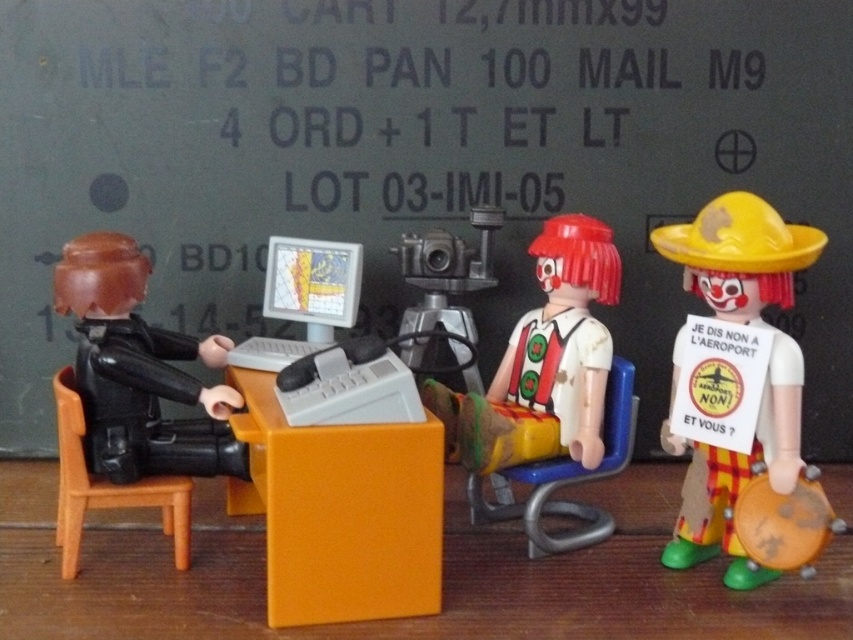
You are a drone operator trying to fly a drone that requires a minimum distance of 1.0 meters from the camera to avoid interference. Based on the coordinates given, can you safely operate the drone from point (508, 403)?

The point (508, 403) is 1.10 meters away from the camera. Since the required minimum distance is 1.0 meters, the drone can be safely operated from this point as it meets the distance requirement.

You are a worker in a factory and you need to reach the white plastic clown at center to perform a quality check. The safety protocol states that you must maintain a minimum distance of 36 inches from any toy figurine during inspection. Can you safely conduct the inspection without violating the protocol?

The white plastic clown at center and the viewer are 38.49 inches apart, which is more than the required 36 inches. Therefore, you can safely conduct the inspection without violating the safety protocol.

You are a security guard in this miniature scene. You need to check the height of the matte black figure at left and the white plastic clown at center to ensure they comply with safety regulations. Which figure is shorter?

The matte black figure at left is not as tall as the white plastic clown at center, so the matte black figure at left is shorter.